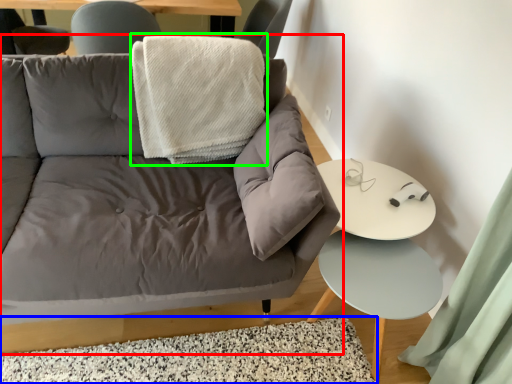
Question: Considering the real-world distances, which object is closest to studio couch (highlighted by a red box)? mat (highlighted by a blue box) or blanket (highlighted by a green box).

Choices:
 (A) mat
 (B) blanket

Answer: (A)